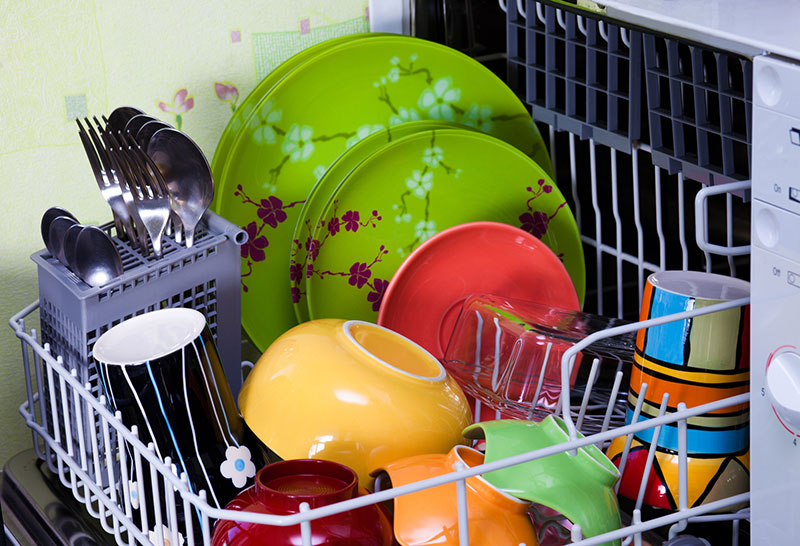
Find the location of `bowls`. bowls is located at coordinates (348, 396), (308, 489), (414, 466), (508, 443).